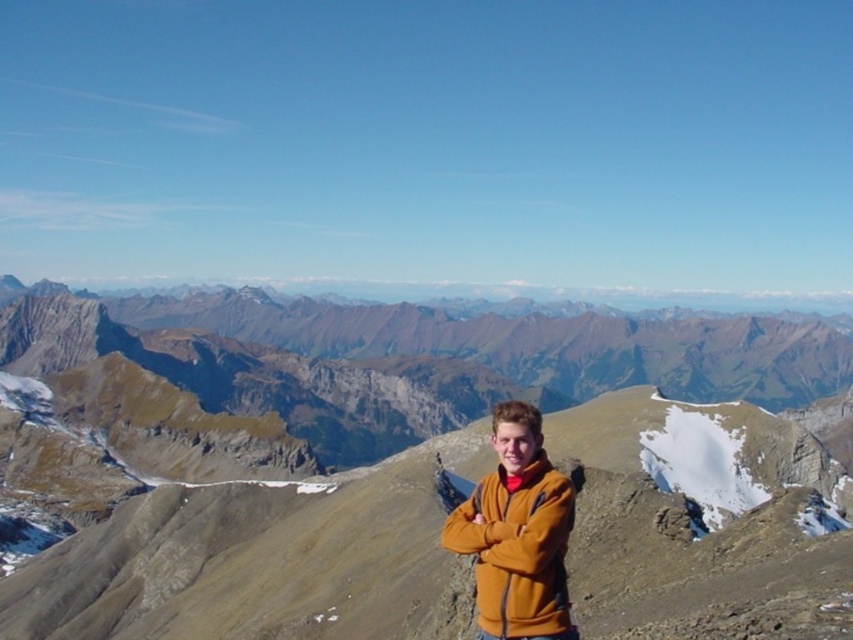
Does brown rocky mountain at center appear on the left side of orange fleece jacket at center?

Indeed, brown rocky mountain at center is positioned on the left side of orange fleece jacket at center.

Does brown rocky mountain at center have a lesser height compared to orange fleece jacket at center?

In fact, brown rocky mountain at center may be taller than orange fleece jacket at center.

Which is behind, point (737, 577) or point (566, 512)?

The point (737, 577) is more distant.

Locate an element on the screen. brown rocky mountain at center is located at coordinates (368, 490).